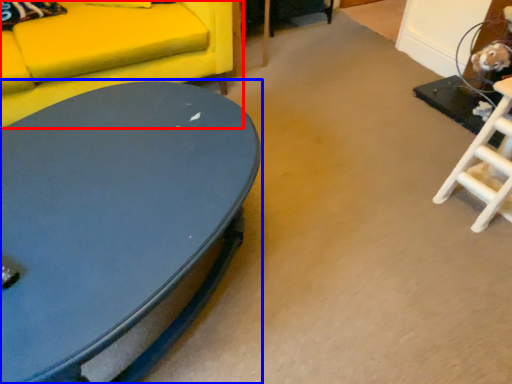
Question: Among these objects, which one is farthest to the camera, studio couch (highlighted by a red box) or coffee table (highlighted by a blue box)?

Choices:
 (A) studio couch
 (B) coffee table

Answer: (A)